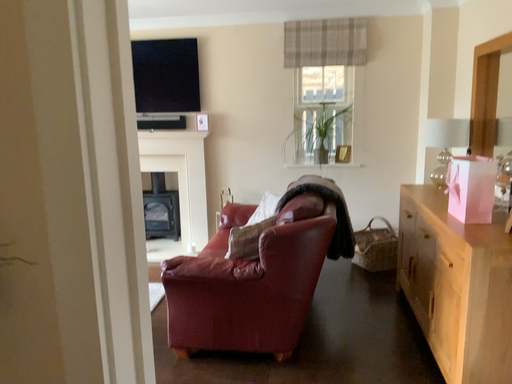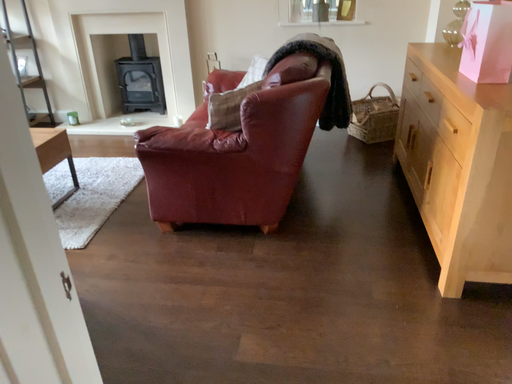
Question: Which way did the camera rotate in the video?

Choices:
 (A) rotated upward
 (B) rotated downward

Answer: (B)